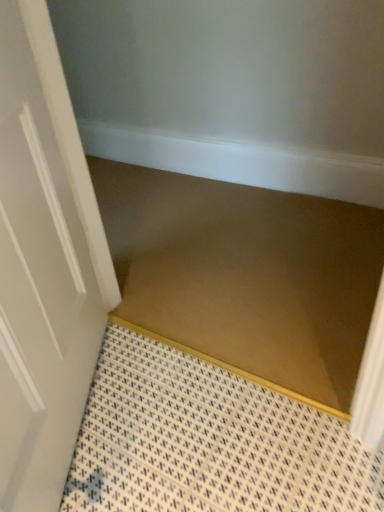
Locate an element on the screen. free space above brown matte stair at center (from a real-world perspective) is located at coordinates (208, 234).